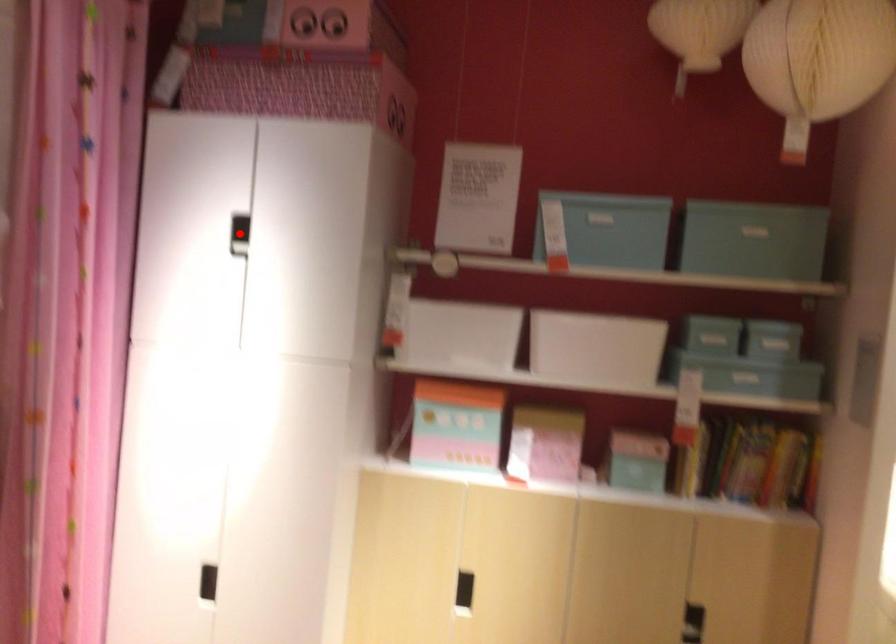
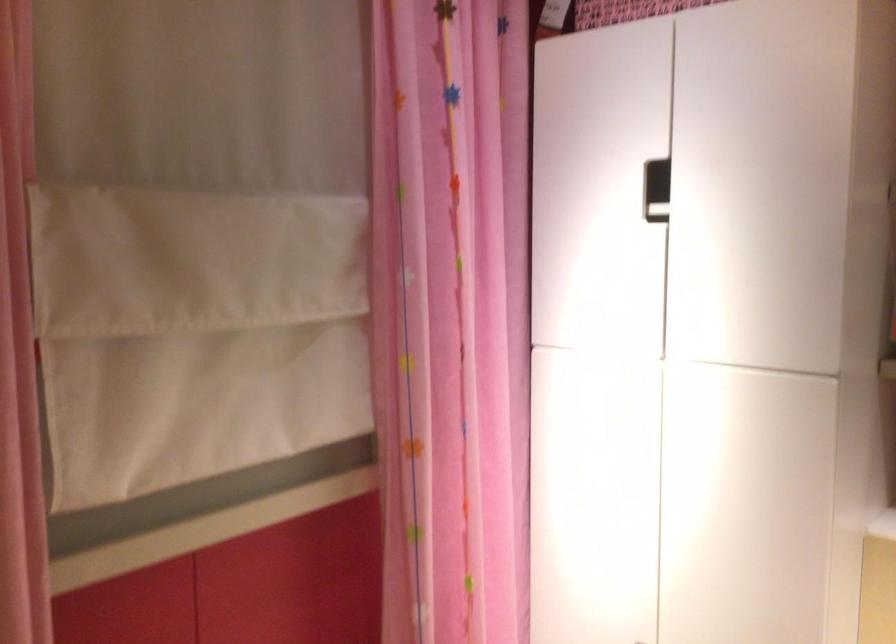
Question: I am providing you with two images of the same scene from different viewpoints. A red point is marked on the first image. Is the red point's position out of view in image 2?

Choices:
 (A) Yes
 (B) No

Answer: (A)